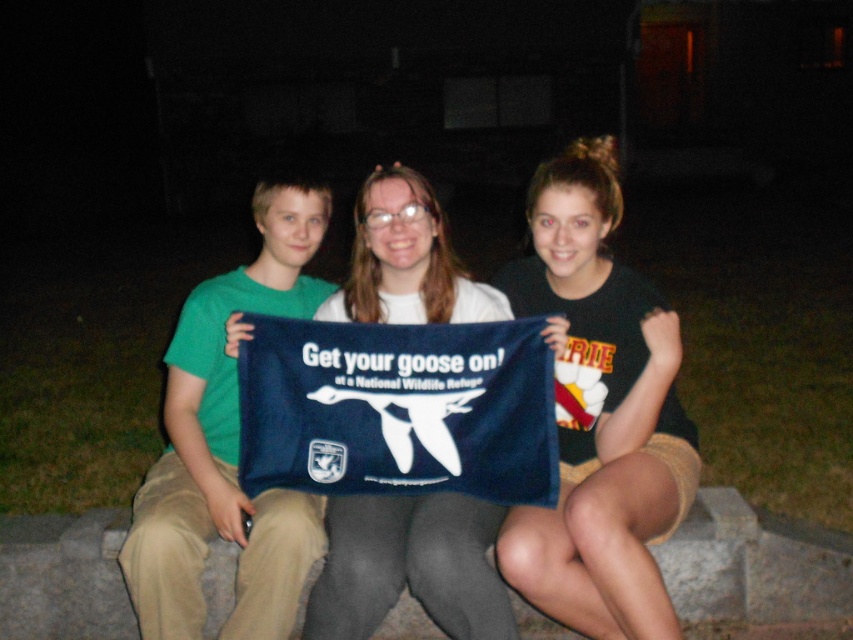
Question: Which point appears closest to the camera in this image?

Choices:
 (A) (554, 332)
 (B) (622, 552)

Answer: (B)

Question: From the image, what is the correct spatial relationship of dark blue fabric towel at center in relation to white fabric towel at center?

Choices:
 (A) left
 (B) right

Answer: (B)

Question: Which point is farther to the camera?

Choices:
 (A) white fabric towel at center
 (B) dark blue fabric towel at center

Answer: (A)

Question: Where is dark blue fabric towel at center located in relation to white fabric towel at center in the image?

Choices:
 (A) left
 (B) right

Answer: (B)

Question: Which of the following is the farthest from the observer?

Choices:
 (A) (367, 600)
 (B) (519, 561)

Answer: (A)

Question: Observing the image, what is the correct spatial positioning of dark blue fabric towel at center in reference to white fabric towel at center?

Choices:
 (A) left
 (B) right

Answer: (B)